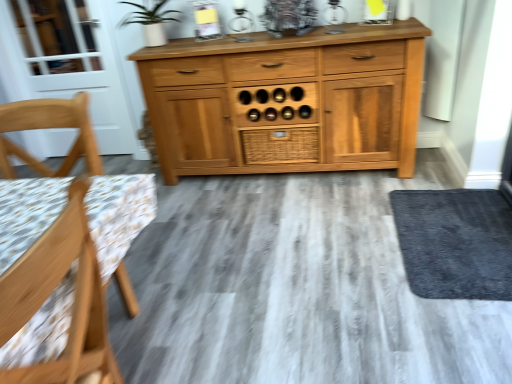
Question: Considering the relative sizes of light wood chair at left, which ranks as the 1th chair in back-to-front order, and wooden chair at left, which appears as the first chair when viewed from the front, in the image provided, is light wood chair at left, which ranks as the 1th chair in back-to-front order, thinner than wooden chair at left, which appears as the first chair when viewed from the front,?

Choices:
 (A) yes
 (B) no

Answer: (B)

Question: Is light wood chair at left, which is the second chair from front to back, positioned beyond the bounds of wooden chair at left, which is counted as the 2th chair, starting from the back?

Choices:
 (A) no
 (B) yes

Answer: (B)

Question: Is light wood chair at left, which ranks as the 1th chair in back-to-front order, oriented away from wooden chair at left, which is counted as the 2th chair, starting from the back?

Choices:
 (A) no
 (B) yes

Answer: (A)

Question: Can you confirm if light wood chair at left, which is the second chair from front to back, is positioned to the left of wooden chair at left, which appears as the first chair when viewed from the front?

Choices:
 (A) yes
 (B) no

Answer: (A)

Question: From the image's perspective, is light wood chair at left, which ranks as the 1th chair in back-to-front order, located above wooden chair at left, which appears as the first chair when viewed from the front?

Choices:
 (A) yes
 (B) no

Answer: (A)

Question: Looking at their shapes, would you say white glass screen door at left is wider or thinner than dark gray carpet at lower right?

Choices:
 (A) wide
 (B) thin

Answer: (B)

Question: In terms of size, does white glass screen door at left appear bigger or smaller than dark gray carpet at lower right?

Choices:
 (A) small
 (B) big

Answer: (B)

Question: Relative to dark gray carpet at lower right, is white glass screen door at left in front or behind?

Choices:
 (A) front
 (B) behind

Answer: (B)

Question: Considering the positions of point (17, 31) and point (433, 193), is point (17, 31) closer or farther from the camera than point (433, 193)?

Choices:
 (A) closer
 (B) farther

Answer: (B)

Question: Is woven wood drawer at center inside the boundaries of wooden chair at left, which is counted as the 2th chair, starting from the back, or outside?

Choices:
 (A) inside
 (B) outside

Answer: (B)

Question: From the image's perspective, is woven wood drawer at center positioned above or below wooden chair at left, which is counted as the 2th chair, starting from the back?

Choices:
 (A) below
 (B) above

Answer: (B)

Question: Is point (254, 147) positioned closer to the camera than point (8, 377)?

Choices:
 (A) farther
 (B) closer

Answer: (A)

Question: In the image, is woven wood drawer at center positioned in front of or behind wooden chair at left, which is counted as the 2th chair, starting from the back?

Choices:
 (A) front
 (B) behind

Answer: (B)

Question: Looking at their shapes, would you say light wood chair at left, which is the second chair from front to back, is wider or thinner than white glass screen door at left?

Choices:
 (A) wide
 (B) thin

Answer: (A)

Question: Considering the positions of point [x=33, y=102] and point [x=120, y=54], is point [x=33, y=102] closer or farther from the camera than point [x=120, y=54]?

Choices:
 (A) farther
 (B) closer

Answer: (B)